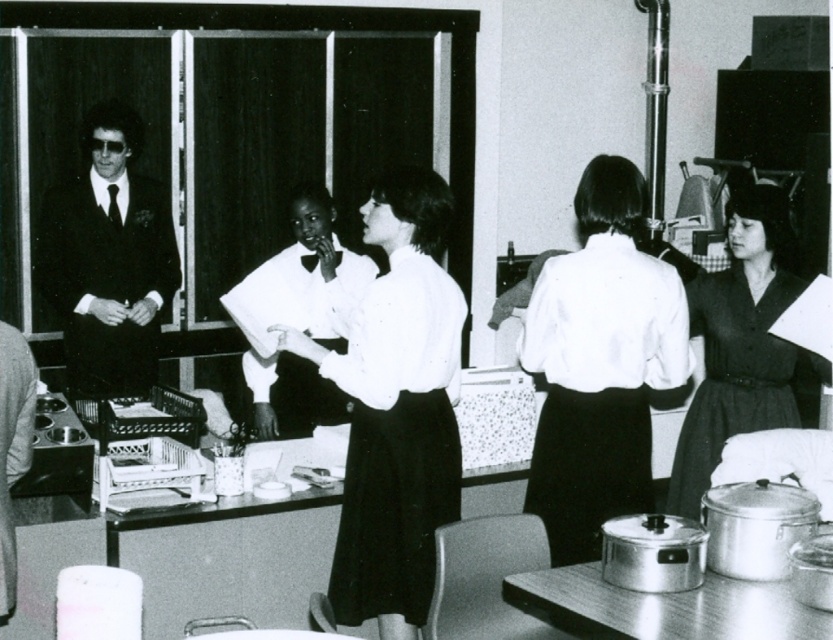
Question: Is white smooth blouse at center below matte black suit at left?

Choices:
 (A) yes
 (B) no

Answer: (A)

Question: Among these points, which one is nearest to the camera?

Choices:
 (A) (315, 182)
 (B) (604, 214)
 (C) (11, 508)

Answer: (C)

Question: Among these objects, which one is nearest to the camera?

Choices:
 (A) white matte shirt at center
 (B) matte black dress at right
 (C) white smooth blouse at center
 (D) smooth leather jacket at left

Answer: (D)

Question: Is matte black suit at left positioned at the back of white satin blouse at center?

Choices:
 (A) yes
 (B) no

Answer: (A)

Question: Where is white smooth blouse at center located in relation to white satin blouse at center in the image?

Choices:
 (A) above
 (B) below

Answer: (B)

Question: Which object is farther from the camera taking this photo?

Choices:
 (A) white satin blouse at center
 (B) matte black dress at right
 (C) white smooth blouse at center
 (D) white matte shirt at center

Answer: (A)